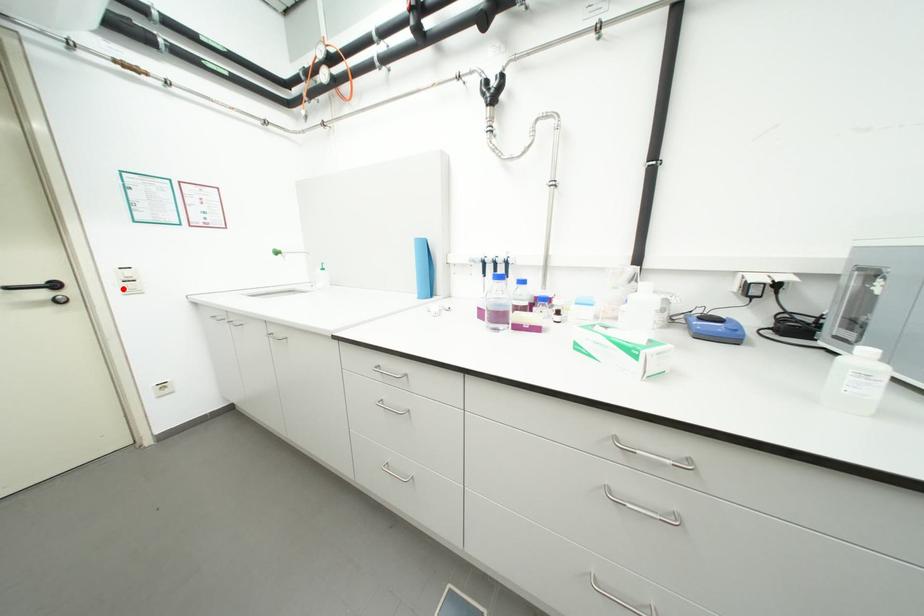
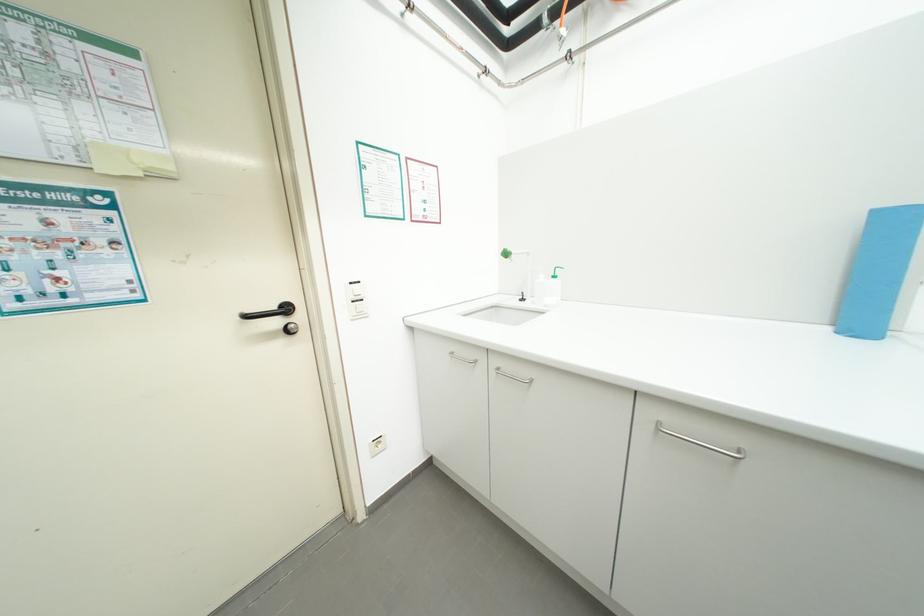
Where in the second image is the point corresponding to the highlighted location from the first image?

(351, 312)